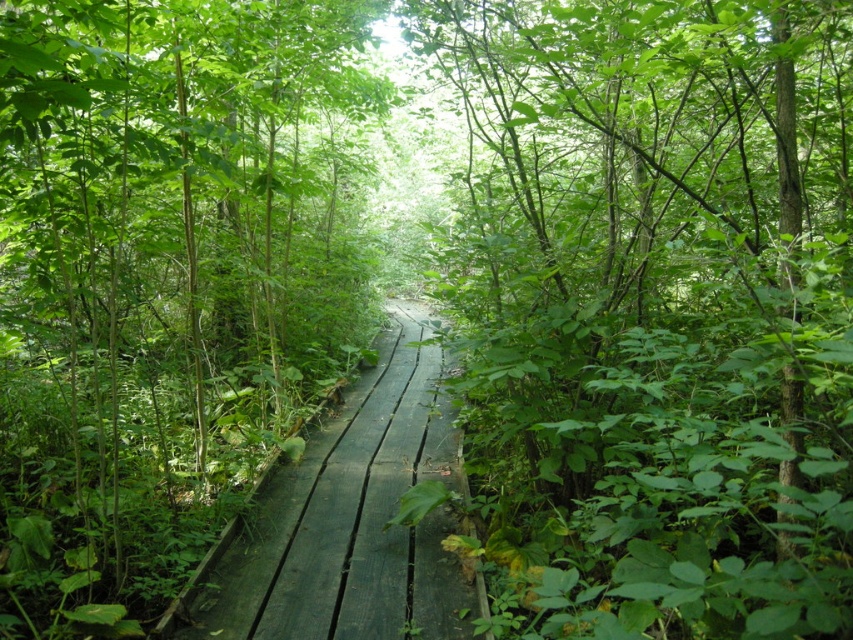
You are standing on the wooden boardwalk pathway in the forest scene. You see a point marked at coordinates (654,310). What object is located at that point?

The point at coordinates (654,310) indicates a green leafy tree at center.